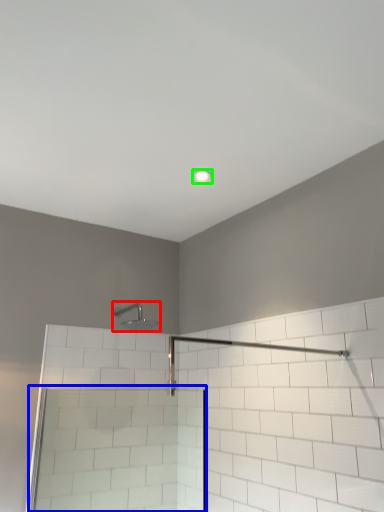
Question: Based on their relative distances, which object is nearer to shower (highlighted by a red box)? Choose from screen door (highlighted by a blue box) and light fixture (highlighted by a green box).

Choices:
 (A) screen door
 (B) light fixture

Answer: (A)